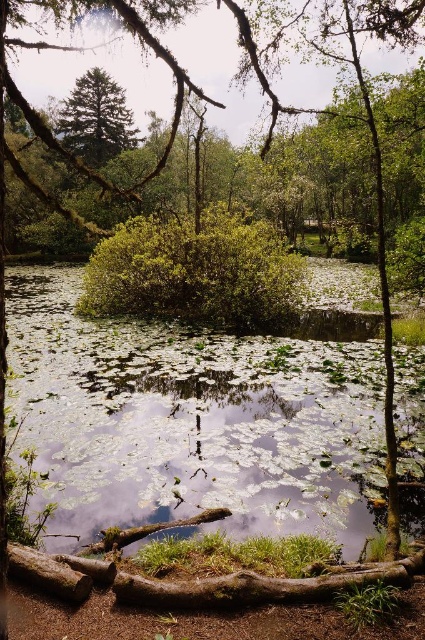
Question: Where is green leafy water at center located in relation to green matte tree at upper left in the image?

Choices:
 (A) below
 (B) above

Answer: (A)

Question: From the image, what is the correct spatial relationship of green leafy water at center in relation to green matte tree at upper left?

Choices:
 (A) left
 (B) right

Answer: (B)

Question: Which of the following is the closest to the observer?

Choices:
 (A) (101, 416)
 (B) (116, 106)

Answer: (A)

Question: Which point is closer to the camera?

Choices:
 (A) (76, 86)
 (B) (359, 508)

Answer: (B)

Question: Can you confirm if green leafy water at center is bigger than green matte tree at upper left?

Choices:
 (A) yes
 (B) no

Answer: (B)